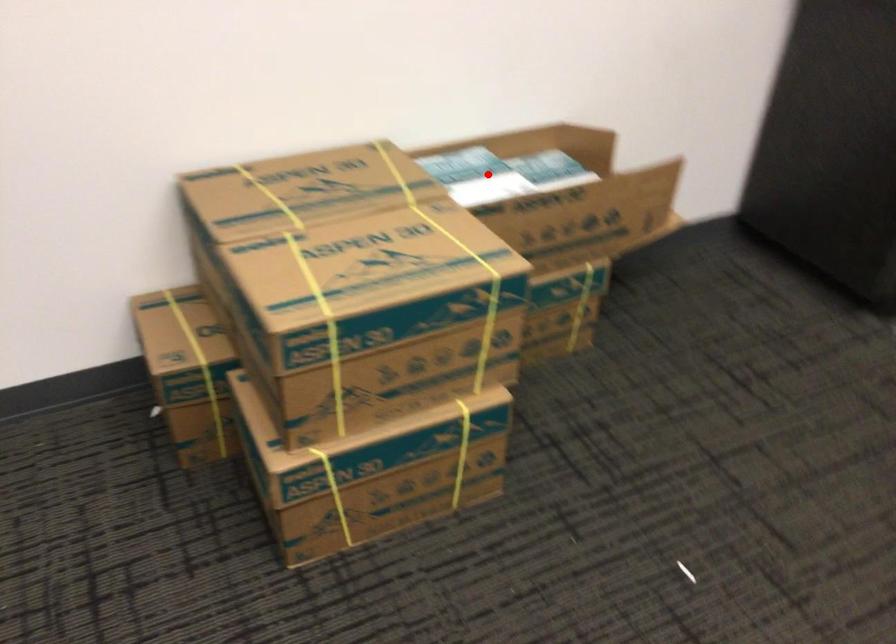
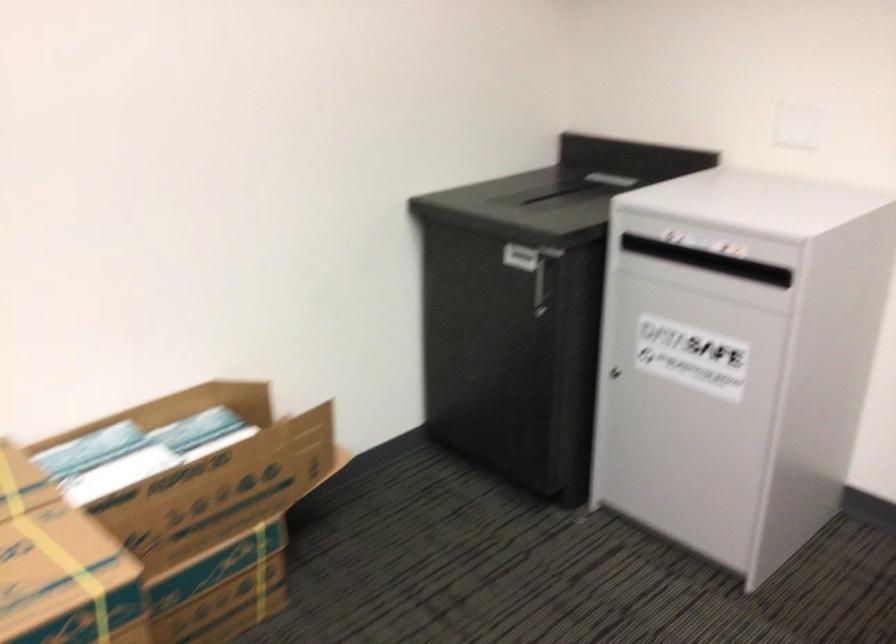
Find the pixel in the second image that matches the highlighted location in the first image.

(136, 451)